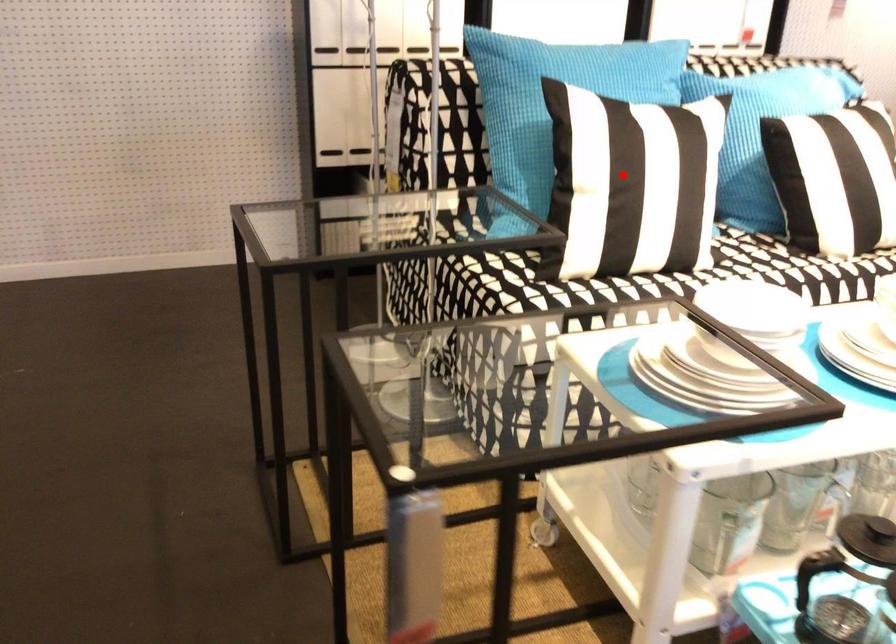
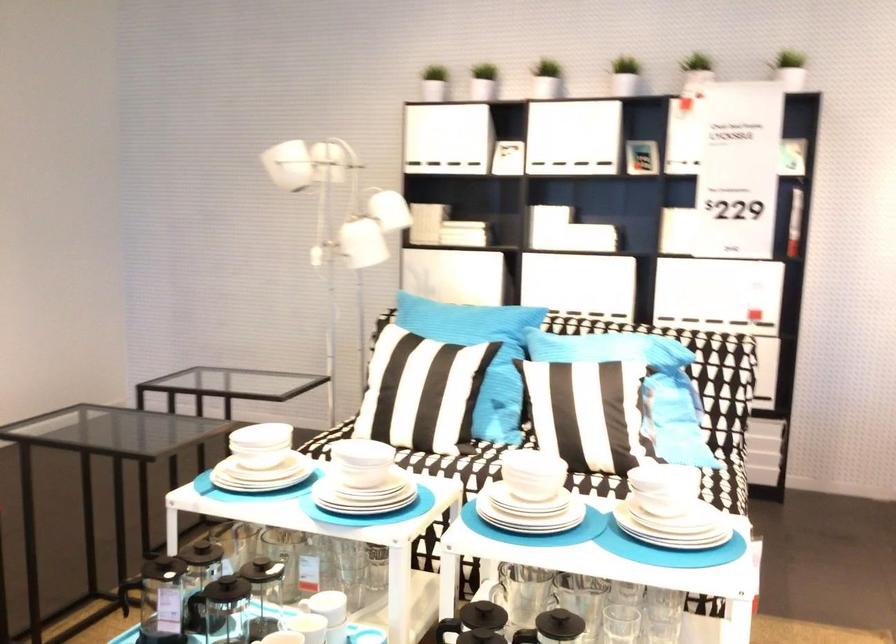
The point at the highlighted location is marked in the first image. Where is the corresponding point in the second image?

(398, 377)